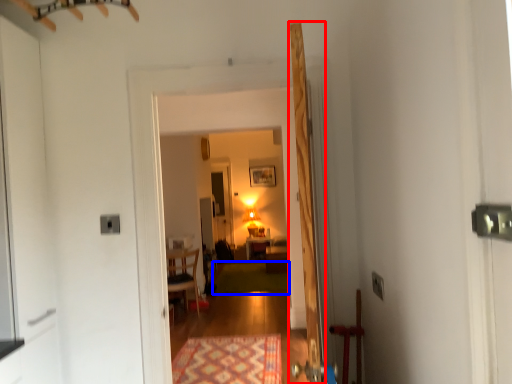
Question: Which of the following is the closest to the observer, door (highlighted by a red box) or mat (highlighted by a blue box)?

Choices:
 (A) door
 (B) mat

Answer: (A)